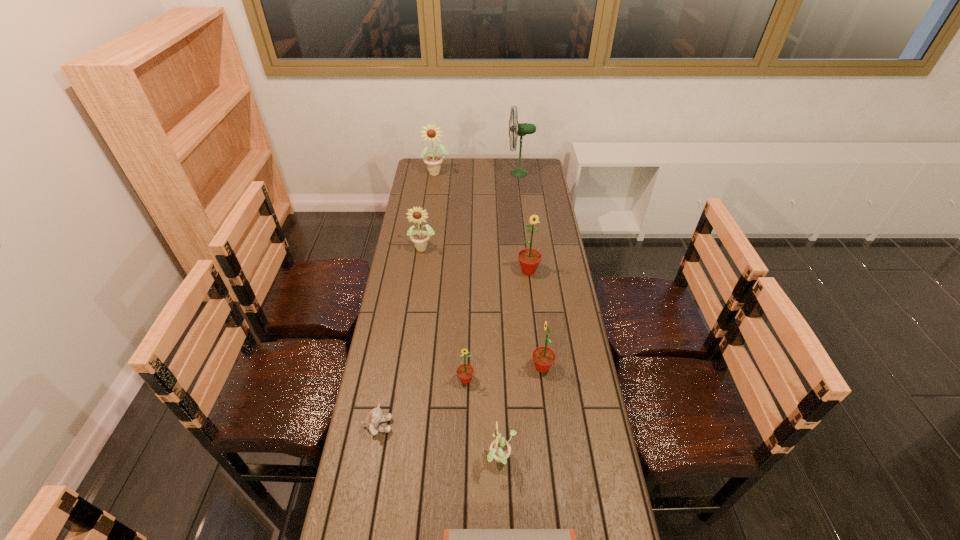
Identify the location of sunflower that is the fifth nearest to the green fan. Image resolution: width=960 pixels, height=540 pixels. (465, 372).

Select which yellow sunflower is the closest to the rightmost yellow sunflower. Please provide its 2D coordinates. Your answer should be formatted as a tuple, i.e. [(x, y)], where the tuple contains the x and y coordinates of a point satisfying the conditions above.

[(420, 238)]

Where is `yellow sunflower that is the closest to the farthest sunflower`? This screenshot has height=540, width=960. yellow sunflower that is the closest to the farthest sunflower is located at coordinates (420, 238).

Find the location of a particular element. This screenshot has width=960, height=540. green sunflower that is the second closest one to the rightmost yellow sunflower is located at coordinates pyautogui.click(x=543, y=357).

Identify the location of green sunflower that is the second closest to the fifth nearest sunflower. This screenshot has height=540, width=960. (465, 372).

Identify the location of vacant region that satisfies the following two spatial constraints: 1. on the face of the fourth farthest object; 2. on the front-facing side of the smallest yellow sunflower. (550, 460).

Where is `vacant space that satisfies the following two spatial constraints: 1. on the front-facing side of the farthest yellow sunflower; 2. on the face of the teddy bear`? vacant space that satisfies the following two spatial constraints: 1. on the front-facing side of the farthest yellow sunflower; 2. on the face of the teddy bear is located at coordinates (402, 426).

This screenshot has width=960, height=540. Identify the location of free spot that satisfies the following two spatial constraints: 1. on the face of the second biggest green sunflower; 2. on the face of the fourth sunflower from right to left. (543, 380).